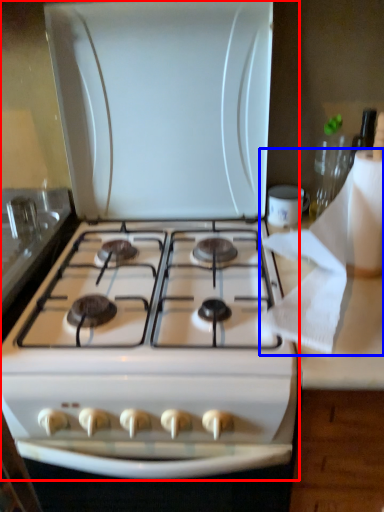
Question: Which object appears farthest to the camera in this image, gas stove (highlighted by a red box) or toilet paper (highlighted by a blue box)?

Choices:
 (A) gas stove
 (B) toilet paper

Answer: (A)